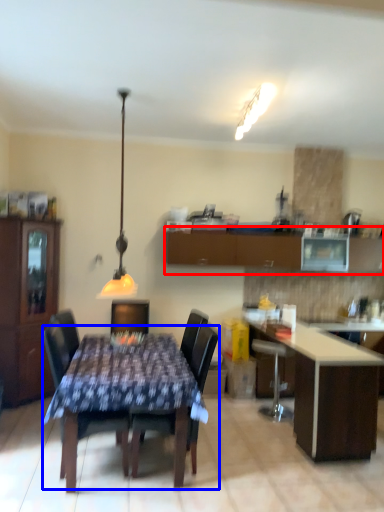
Question: Which object appears farthest to the camera in this image, cabinetry (highlighted by a red box) or kitchen & dining room table (highlighted by a blue box)?

Choices:
 (A) cabinetry
 (B) kitchen & dining room table

Answer: (A)